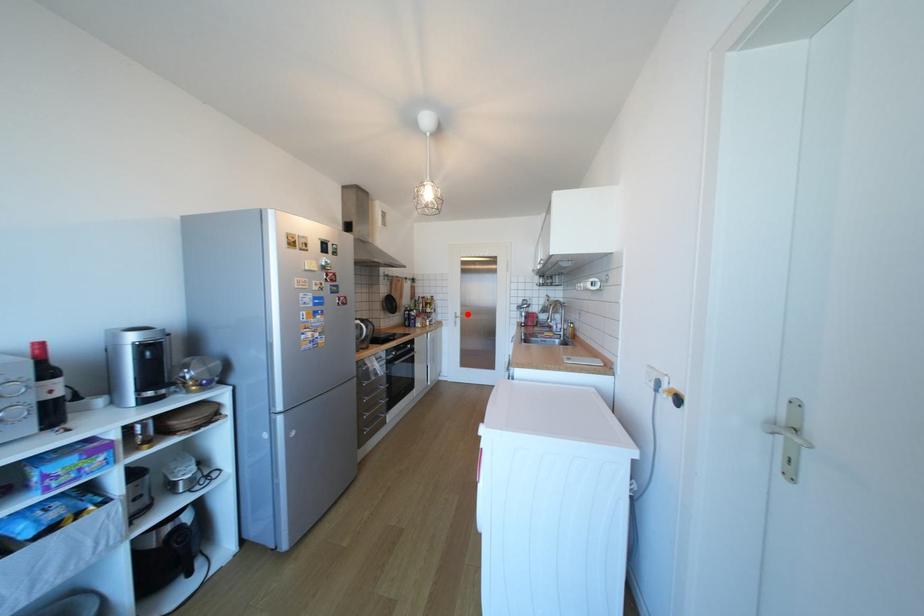
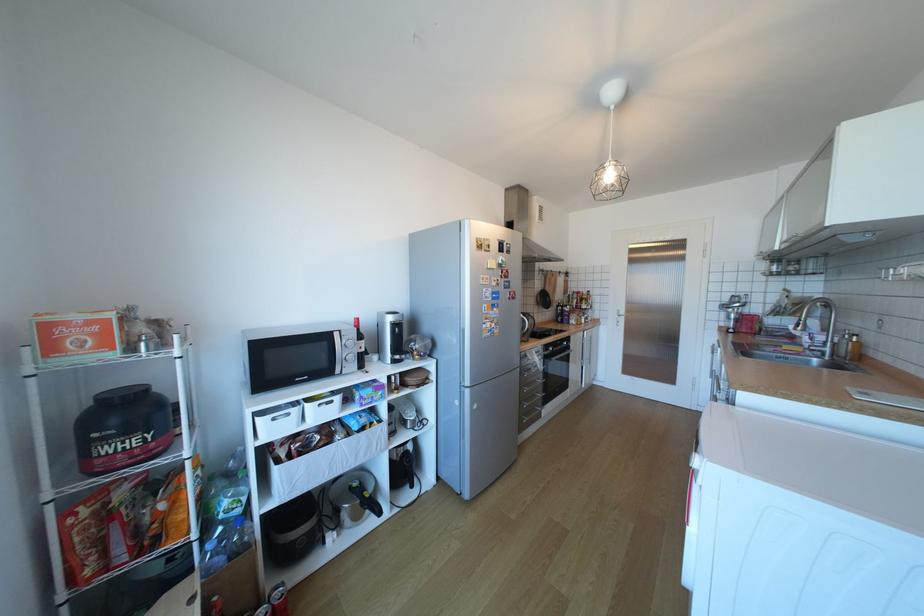
In the second image, find the point that corresponds to the highlighted location in the first image.

(631, 312)